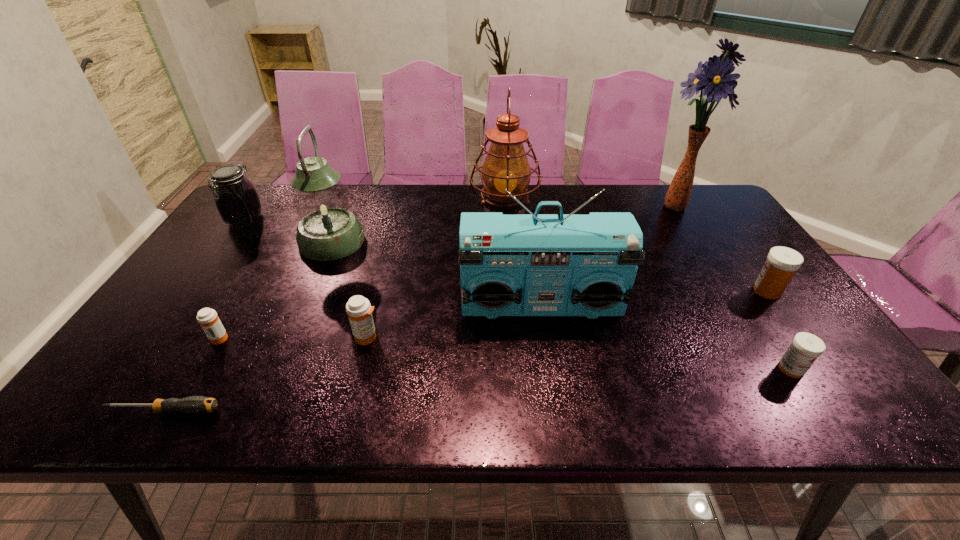
What are the coordinates of `vacant region located 0.400m on the lid of the jar` in the screenshot? It's located at (170, 325).

Identify the location of vacant region located on the front of the bigger white medicine. 819,362.

The width and height of the screenshot is (960, 540). What are the coordinates of `free space located 0.070m on the left of the bigger orange medicine` in the screenshot? It's located at (324, 337).

This screenshot has height=540, width=960. I want to click on vacant space located on the back of the left orange medicine, so click(241, 300).

The height and width of the screenshot is (540, 960). I want to click on vacant space located 0.210m on the left of the left white medicine, so click(684, 369).

Where is `free location located on the back of the nearest object`? free location located on the back of the nearest object is located at coordinates (196, 357).

At what (x,y) coordinates should I click in order to perform the action: click on flower arrangement positioned at the far edge. Please return your answer as a coordinate pair (x, y). This screenshot has width=960, height=540. Looking at the image, I should click on (715, 79).

Identify the location of oil lamp present at the far edge. (506, 166).

In order to click on jar positioned at the far edge in this screenshot , I will do `click(236, 199)`.

Identify the location of object situated at the near edge. (194, 404).